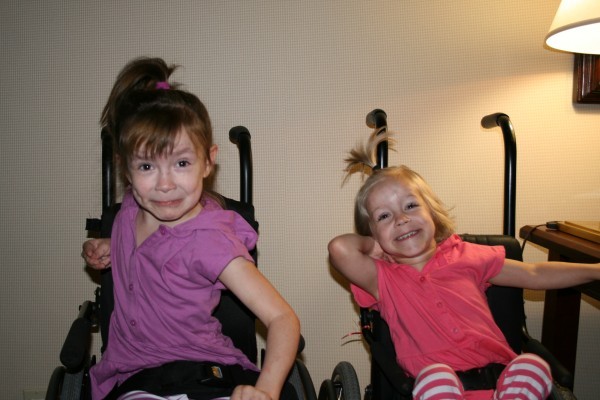
You are a GUI agent. You are given a task and a screenshot of the screen. Output one action in this format:
    pyautogui.click(x=<x>, y=<y>)
    Task: Click on the wall
    
    Given the screenshot: What is the action you would take?
    pyautogui.click(x=66, y=110), pyautogui.click(x=384, y=50)